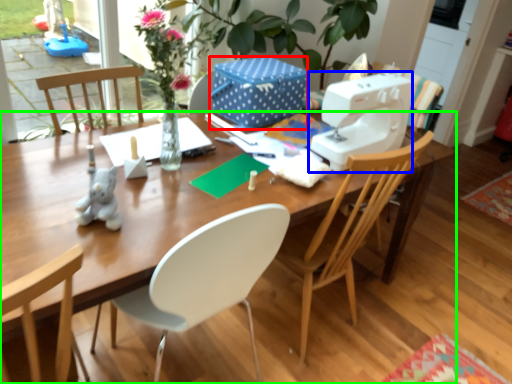
Question: Considering the real-world distances, which object is closest to box (highlighted by a red box)? sewing machine (highlighted by a blue box) or desk (highlighted by a green box).

Choices:
 (A) sewing machine
 (B) desk

Answer: (A)